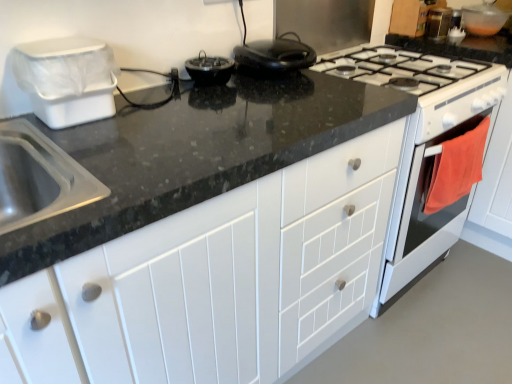
Question: Is white plastic bin at left, which appears as the 3th appliance when viewed from the top, at the right side of orange fabric oven at right, marked as the 1th oven in a front-to-back arrangement?

Choices:
 (A) no
 (B) yes

Answer: (A)

Question: Is white plastic bin at left, the first appliance when ordered from left to right, beside orange fabric oven at right, placed as the 2th oven when sorted from back to front?

Choices:
 (A) no
 (B) yes

Answer: (A)

Question: Is white plastic bin at left, the 3th appliance when ordered from back to front, far from orange fabric oven at right, marked as the 1th oven in a front-to-back arrangement?

Choices:
 (A) yes
 (B) no

Answer: (A)

Question: Would you say white plastic bin at left, placed as the 1th appliance when sorted from front to back, contains orange fabric oven at right, marked as the 1th oven in a front-to-back arrangement?

Choices:
 (A) yes
 (B) no

Answer: (B)

Question: Considering the relative sizes of white plastic bin at left, the 3th appliance when ordered from back to front, and orange fabric oven at right, placed as the 2th oven when sorted from back to front, in the image provided, is white plastic bin at left, the 3th appliance when ordered from back to front, bigger than orange fabric oven at right, placed as the 2th oven when sorted from back to front,?

Choices:
 (A) no
 (B) yes

Answer: (B)

Question: Is white plastic bin at left, the 3th appliance when ordered from back to front, looking in the opposite direction of orange fabric oven at right, placed as the 2th oven when sorted from back to front?

Choices:
 (A) yes
 (B) no

Answer: (B)

Question: From the image's perspective, is white glossy oven at right, the first oven viewed from the back, located beneath white plastic bin at left, the first appliance in the bottom-to-top sequence?

Choices:
 (A) yes
 (B) no

Answer: (B)

Question: Is white glossy oven at right, which appears as the 2th oven when viewed from the front, aimed at white plastic bin at left, the first appliance when ordered from left to right?

Choices:
 (A) yes
 (B) no

Answer: (A)

Question: From a real-world perspective, is white glossy oven at right, which appears as the 2th oven when viewed from the front, below white plastic bin at left, the 3th appliance when ordered from back to front?

Choices:
 (A) no
 (B) yes

Answer: (B)

Question: Considering the relative positions of white glossy oven at right, the first oven viewed from the back, and white plastic bin at left, the 3th appliance when ordered from back to front, in the image provided, is white glossy oven at right, the first oven viewed from the back, to the right of white plastic bin at left, the 3th appliance when ordered from back to front, from the viewer's perspective?

Choices:
 (A) yes
 (B) no

Answer: (A)

Question: Does white glossy oven at right, which appears as the 2th oven when viewed from the front, have a greater height compared to white plastic bin at left, the third appliance viewed from the right?

Choices:
 (A) yes
 (B) no

Answer: (A)

Question: Is white glossy oven at right, the first oven viewed from the back, to the left of white plastic bin at left, the 3th appliance when ordered from back to front, from the viewer's perspective?

Choices:
 (A) yes
 (B) no

Answer: (B)

Question: From a real-world perspective, is transparent plastic bowl at upper right, the 1th appliance from the top, physically below white glossy oven at right, which appears as the 2th oven when viewed from the front?

Choices:
 (A) no
 (B) yes

Answer: (A)